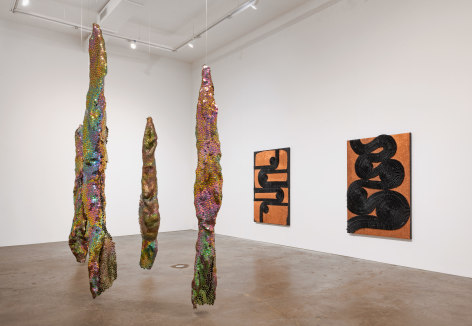
Locate an element on the screen. Image resolution: width=472 pixels, height=326 pixels. light is located at coordinates (135, 43).